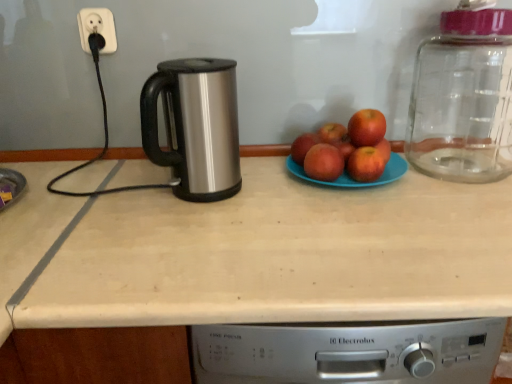
Question: Which direction should I rotate to face red matte apple at center, placed as the 3th apple when sorted from back to front, — up or down?

Choices:
 (A) up
 (B) down

Answer: (A)

Question: Is blue matte plate at center inside red matte apple at center, placed as the 3th apple when sorted from back to front?

Choices:
 (A) no
 (B) yes

Answer: (A)

Question: Is red matte apple at center, which is the third apple from front to back, closer to the viewer compared to blue matte plate at center?

Choices:
 (A) no
 (B) yes

Answer: (A)

Question: Considering the relative sizes of red matte apple at center, which is the third apple from front to back, and blue matte plate at center in the image provided, is red matte apple at center, which is the third apple from front to back, smaller than blue matte plate at center?

Choices:
 (A) no
 (B) yes

Answer: (B)

Question: From the image's perspective, is red matte apple at center, which is the third apple from front to back, on top of blue matte plate at center?

Choices:
 (A) no
 (B) yes

Answer: (B)

Question: Is red matte apple at center, which is the third apple from front to back, at the left side of blue matte plate at center?

Choices:
 (A) no
 (B) yes

Answer: (A)

Question: Considering the relative sizes of red matte apple at center, the 1th apple positioned from the back, and polished stainless steel kettle at center in the image provided, is red matte apple at center, the 1th apple positioned from the back, thinner than polished stainless steel kettle at center?

Choices:
 (A) no
 (B) yes

Answer: (B)

Question: Is red matte apple at center, the 1th apple positioned from the back, aimed at polished stainless steel kettle at center?

Choices:
 (A) no
 (B) yes

Answer: (A)

Question: Does red matte apple at center, the 1th apple positioned from the back, have a smaller size compared to polished stainless steel kettle at center?

Choices:
 (A) no
 (B) yes

Answer: (B)

Question: Is red matte apple at center, the 1th apple positioned from the back, oriented away from polished stainless steel kettle at center?

Choices:
 (A) no
 (B) yes

Answer: (A)

Question: Is red matte apple at center, the 1th apple positioned from the back, far away from polished stainless steel kettle at center?

Choices:
 (A) no
 (B) yes

Answer: (A)

Question: Considering the relative positions of red matte apple at center, the 1th apple positioned from the back, and polished stainless steel kettle at center in the image provided, is red matte apple at center, the 1th apple positioned from the back, to the left of polished stainless steel kettle at center from the viewer's perspective?

Choices:
 (A) yes
 (B) no

Answer: (B)

Question: Can you confirm if beige laminate countertop at center is thinner than blue matte plate at center?

Choices:
 (A) yes
 (B) no

Answer: (B)